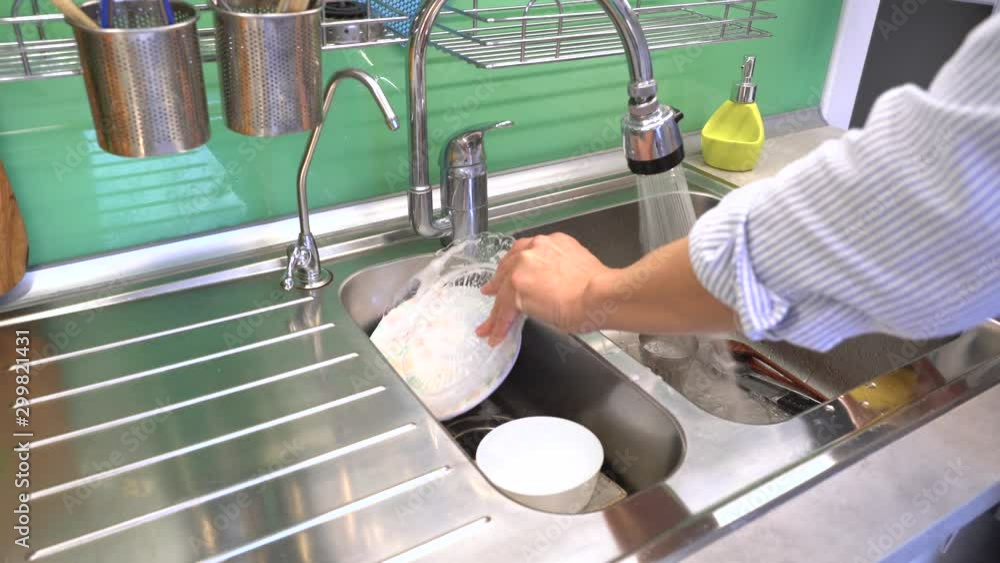
At what (x,y) coordinates should I click in order to perform the action: click on cannister. Please return your answer as a coordinate pair (x, y). Image resolution: width=1000 pixels, height=563 pixels. Looking at the image, I should click on pyautogui.click(x=163, y=100).